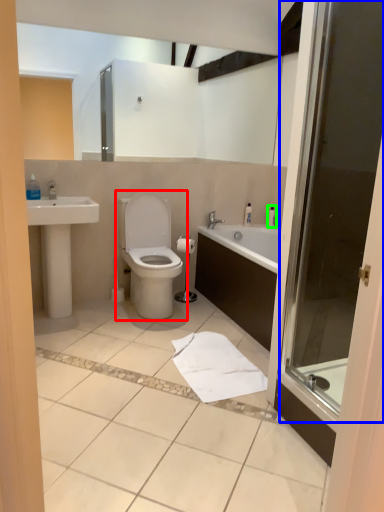
Question: Considering the real-world distances, which object is farthest from toilet (highlighted by a red box)? screen door (highlighted by a blue box) or toiletry (highlighted by a green box)?

Choices:
 (A) screen door
 (B) toiletry

Answer: (A)